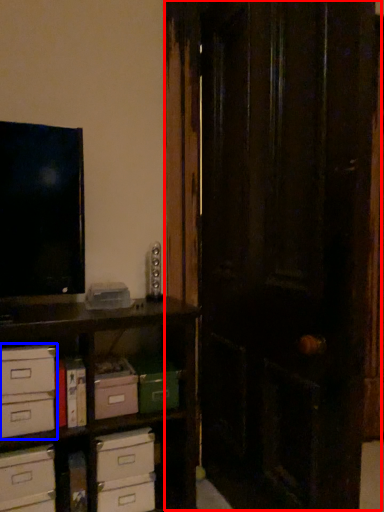
Question: Which of the following is the farthest to the observer, door (highlighted by a red box) or chest of drawers (highlighted by a blue box)?

Choices:
 (A) door
 (B) chest of drawers

Answer: (B)